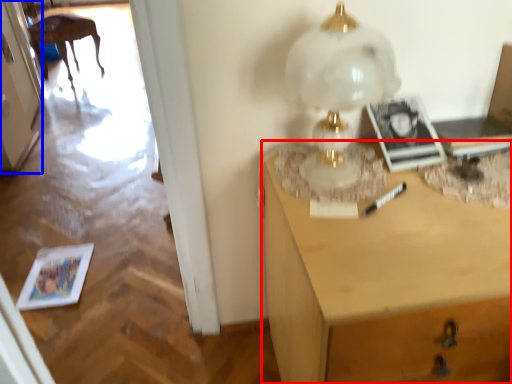
Question: Which object is closer to the camera taking this photo, desk (highlighted by a red box) or door (highlighted by a blue box)?

Choices:
 (A) desk
 (B) door

Answer: (A)